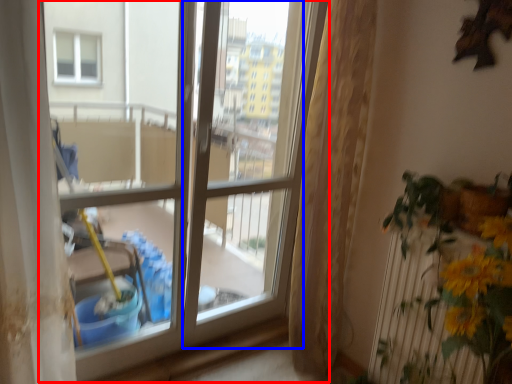
Question: Which point is further to the camera, window (highlighted by a red box) or screen door (highlighted by a blue box)?

Choices:
 (A) window
 (B) screen door

Answer: (B)